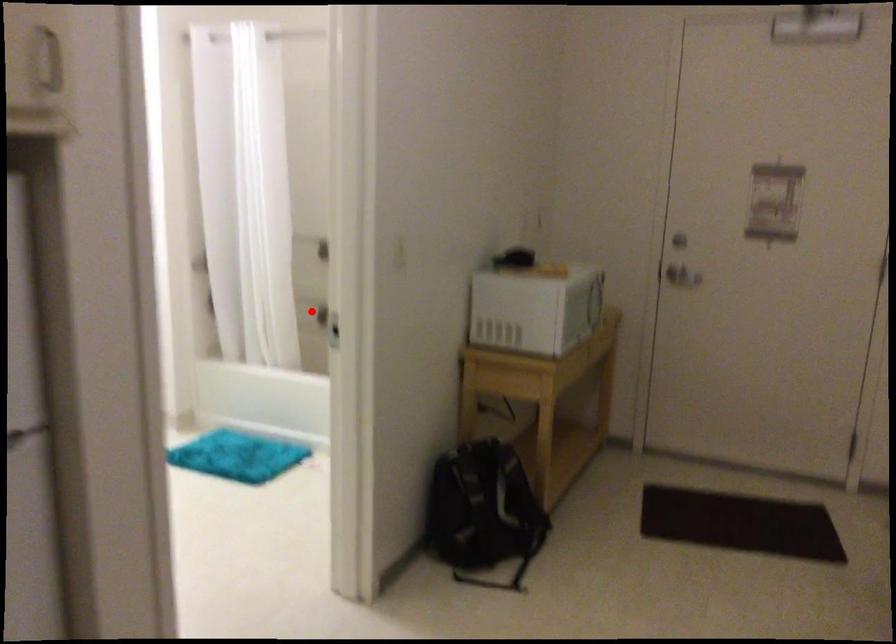
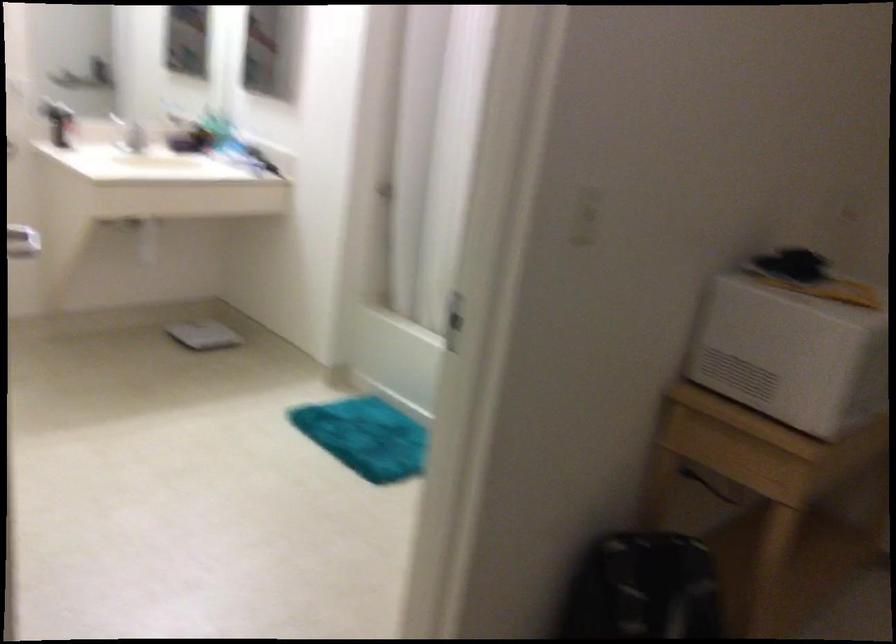
Question: I am providing you with two images of the same scene from different viewpoints. A red point is marked on the first image. Can you still see the location of the red point in image 2?

Choices:
 (A) Yes
 (B) No

Answer: (B)